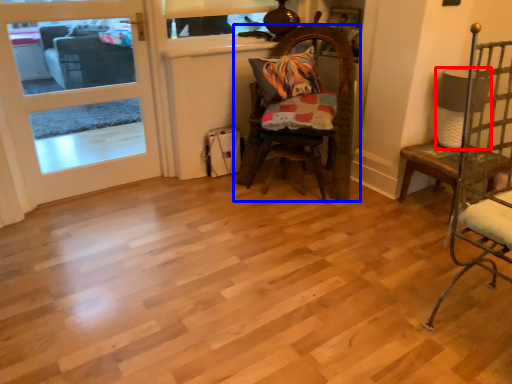
Question: Which object appears farthest to the camera in this image, lamp (highlighted by a red box) or chair (highlighted by a blue box)?

Choices:
 (A) lamp
 (B) chair

Answer: (A)